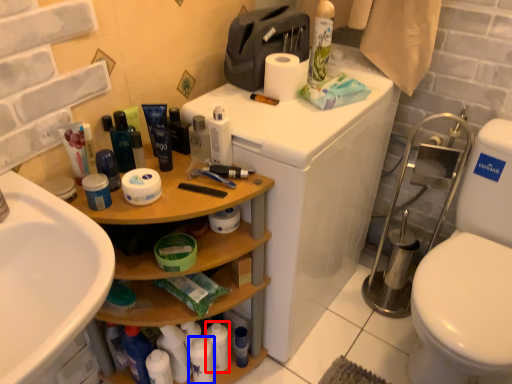
Question: Which object appears farthest to the camera in this image, toiletry (highlighted by a red box) or toiletry (highlighted by a blue box)?

Choices:
 (A) toiletry
 (B) toiletry

Answer: (A)